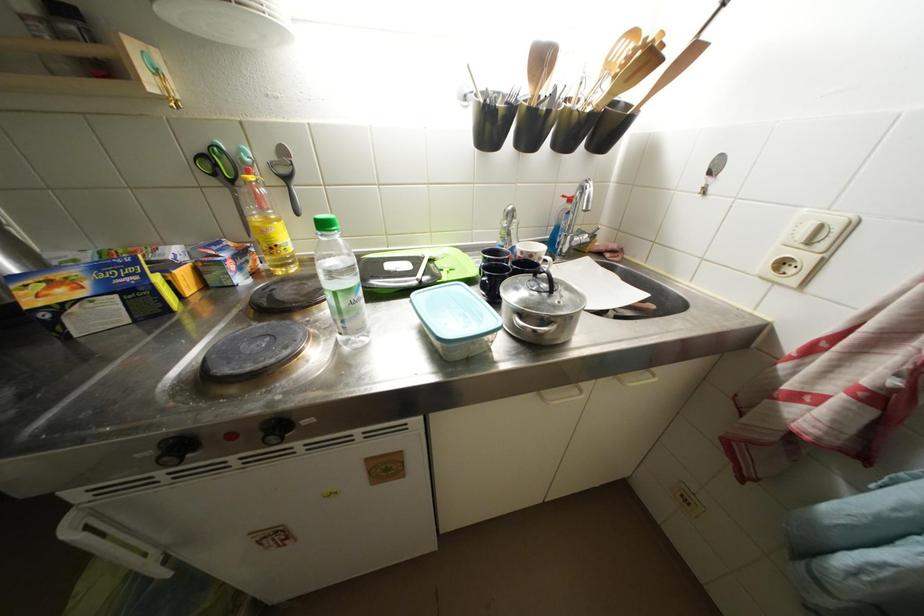
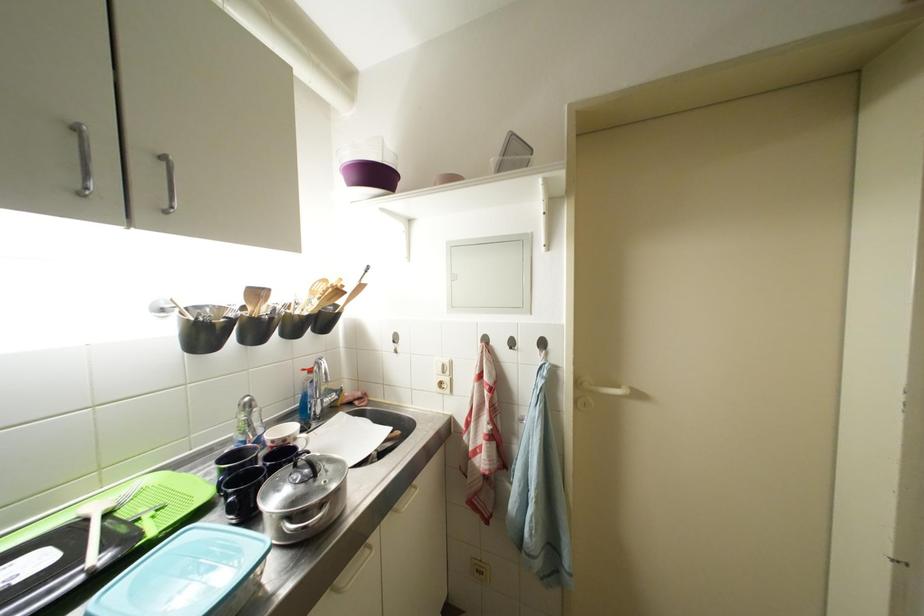
Question: The images are taken continuously from a first-person perspective. In which direction is your viewpoint rotating?

Choices:
 (A) Left
 (B) Right
 (C) Up
 (D) Down

Answer: (B)